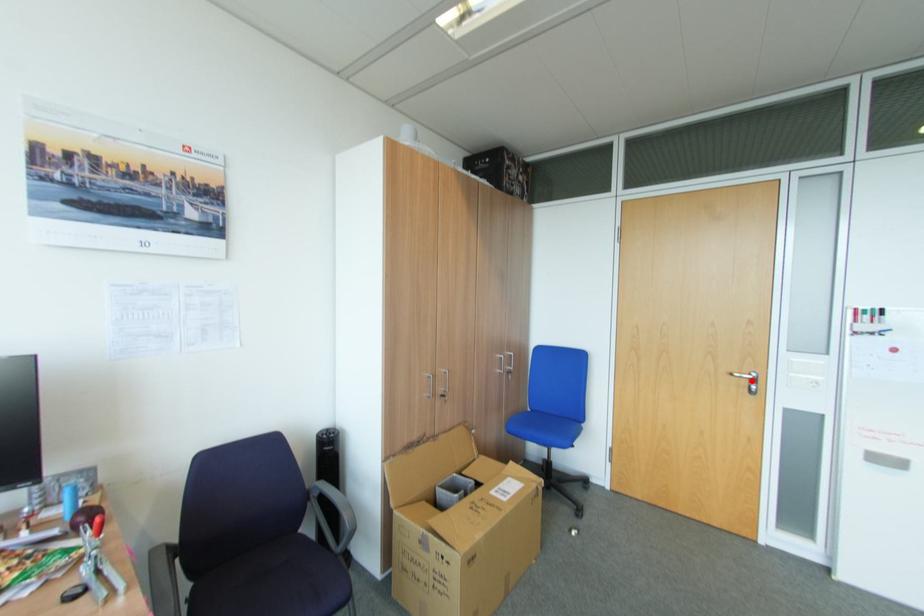
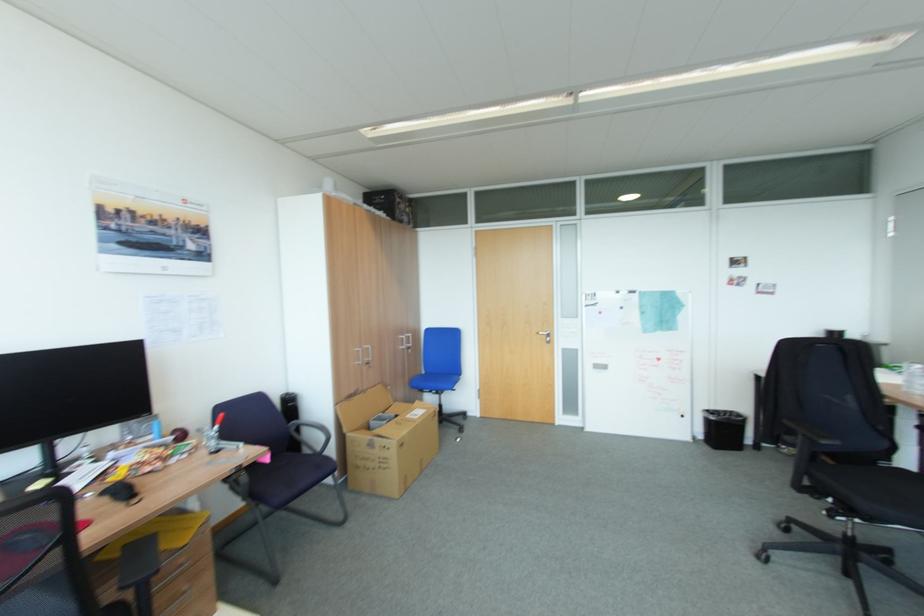
In the second image, find the point that corresponds to the highlighted location in the first image.

(551, 336)